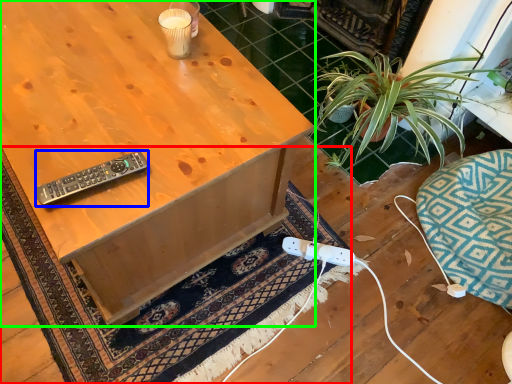
Question: Which object is the closest to the doormat (highlighted by a red box)? Choose among these: remote control (highlighted by a blue box) or desk (highlighted by a green box).

Choices:
 (A) remote control
 (B) desk

Answer: (B)